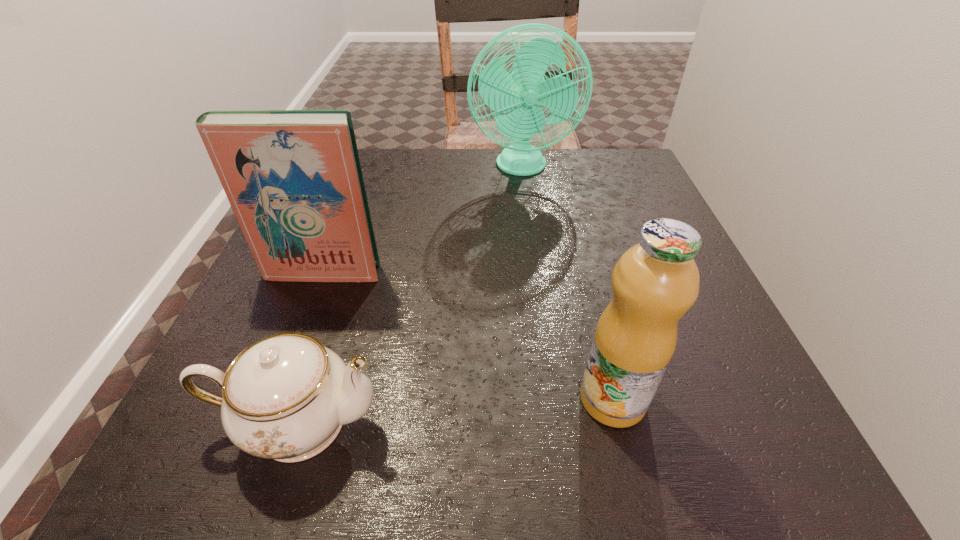
Find the location of a particular element. This screenshot has width=960, height=540. the farthest object is located at coordinates (518, 92).

You are a GUI agent. You are given a task and a screenshot of the screen. Output one action in this format:
    pyautogui.click(x=<x>, y=<y>)
    Task: Click on the third nearest object
    
    Given the screenshot: What is the action you would take?
    pyautogui.click(x=293, y=178)

Locate an element on the screen. The image size is (960, 540). fruit juice is located at coordinates (655, 282).

Where is `chinaware`? The width and height of the screenshot is (960, 540). chinaware is located at coordinates (285, 397).

Where is `vacant space located 0.180m in front of the fan to blow air`? The image size is (960, 540). vacant space located 0.180m in front of the fan to blow air is located at coordinates (531, 230).

This screenshot has width=960, height=540. In order to click on vacant region located 0.360m on the cover of the third nearest object in this screenshot , I will do `click(240, 483)`.

Where is `blank space located at the spout of the shortest object`? blank space located at the spout of the shortest object is located at coordinates (609, 422).

Where is `object present at the far edge`? The width and height of the screenshot is (960, 540). object present at the far edge is located at coordinates click(518, 92).

You are a GUI agent. You are given a task and a screenshot of the screen. Output one action in this format:
    pyautogui.click(x=<x>, y=<y>)
    Task: Click on the fruit juice located at the near edge
    Image resolution: width=960 pixels, height=540 pixels.
    Given the screenshot: What is the action you would take?
    pyautogui.click(x=655, y=282)

You are a GUI agent. You are given a task and a screenshot of the screen. Output one action in this format:
    pyautogui.click(x=<x>, y=<y>)
    Task: Click on the chinaware present at the near edge
    The width and height of the screenshot is (960, 540).
    Given the screenshot: What is the action you would take?
    pyautogui.click(x=285, y=397)